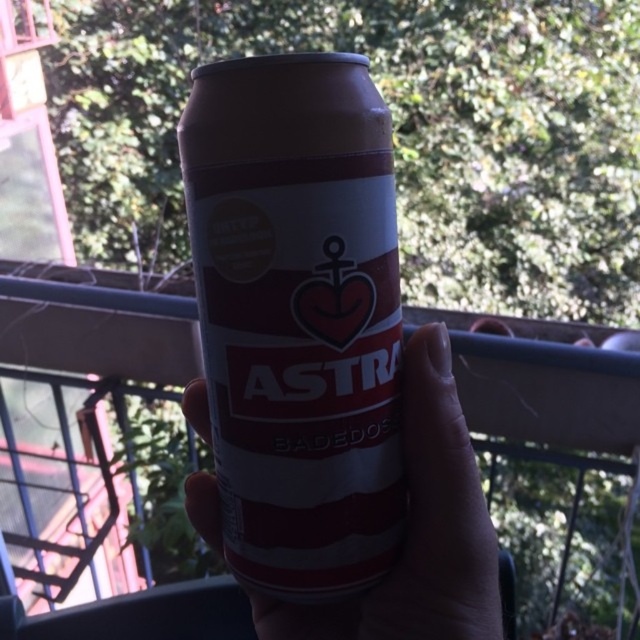
Between matte red can at center and matte plastic can at center, which one is positioned higher?

matte red can at center is higher up.

Where is `matte red can at center`? matte red can at center is located at coordinates pyautogui.click(x=298, y=316).

Where is `matte red can at center`? The width and height of the screenshot is (640, 640). matte red can at center is located at coordinates (298, 316).